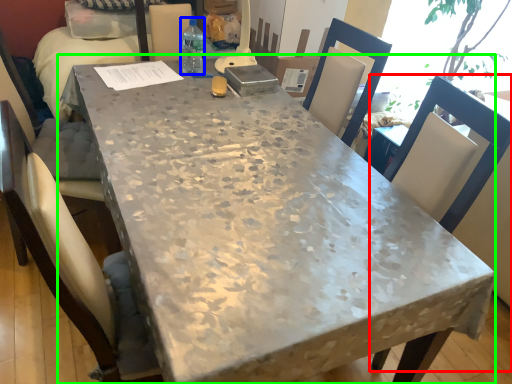
Question: Which object is the closest to the chair (highlighted by a red box)? Choose among these: bottle (highlighted by a blue box) or table (highlighted by a green box).

Choices:
 (A) bottle
 (B) table

Answer: (B)